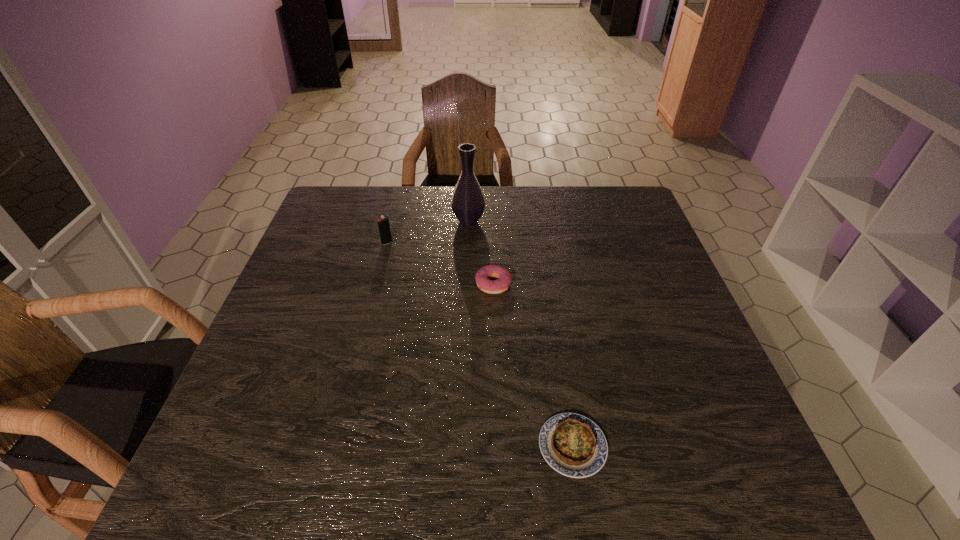
At what (x,y) coordinates should I click in order to perform the action: click on object that is the closest to the doughnut. Please return your answer as a coordinate pair (x, y). Looking at the image, I should click on (468, 203).

Where is `object that is the third nearest to the nearest object`? object that is the third nearest to the nearest object is located at coordinates (383, 224).

The image size is (960, 540). What are the coordinates of `vacant space that satisfies the following two spatial constraints: 1. on the front side of the third tallest object; 2. on the left side of the shortest object` in the screenshot? It's located at (499, 446).